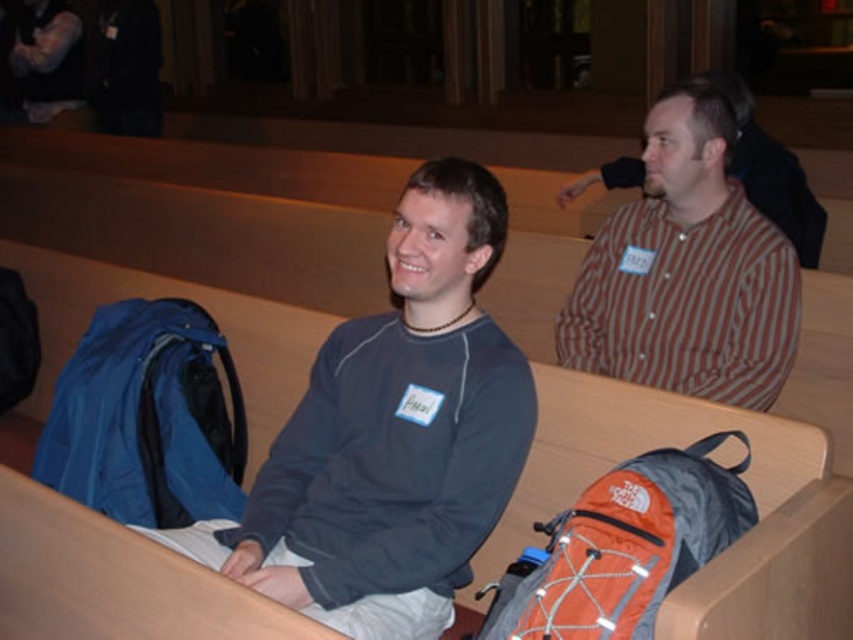
Is matte gray sweater at center further to camera compared to blue fabric backpack at lower left?

No, it is not.

Is matte gray sweater at center in front of blue fabric backpack at lower left?

Yes, matte gray sweater at center is in front of blue fabric backpack at lower left.

The width and height of the screenshot is (853, 640). What do you see at coordinates (392, 435) in the screenshot?
I see `matte gray sweater at center` at bounding box center [392, 435].

Locate an element on the screen. The height and width of the screenshot is (640, 853). matte gray sweater at center is located at coordinates (392, 435).

Does striped cotton shirt at upper right appear under blue fabric backpack at lower left?

Actually, striped cotton shirt at upper right is above blue fabric backpack at lower left.

I want to click on striped cotton shirt at upper right, so click(x=688, y=269).

Between matte gray sweater at center and striped cotton shirt at upper right, which one is positioned higher?

striped cotton shirt at upper right is higher up.

From the picture: Can you confirm if matte gray sweater at center is bigger than striped cotton shirt at upper right?

Correct, matte gray sweater at center is larger in size than striped cotton shirt at upper right.

Between point (456, 269) and point (610, 253), which one is positioned behind?

Positioned behind is point (610, 253).

The image size is (853, 640). I want to click on matte gray sweater at center, so click(x=392, y=435).